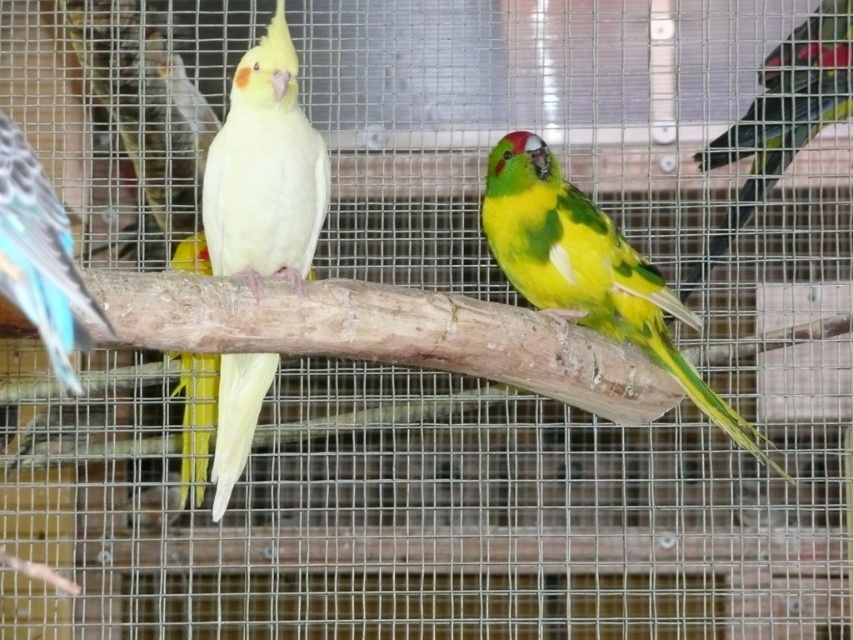
Question: Does green glossy parrot at right come behind yellow matte parrot at center?

Choices:
 (A) no
 (B) yes

Answer: (B)

Question: Which object is farther from the camera taking this photo?

Choices:
 (A) green glossy parrot at right
 (B) green matte parrot at center
 (C) yellow matte parrot at center

Answer: (A)

Question: Which object is farther from the camera taking this photo?

Choices:
 (A) yellow matte parrot at center
 (B) matte yellow parrot at center
 (C) green glossy parrot at right

Answer: (C)

Question: Among these objects, which one is farthest from the camera?

Choices:
 (A) yellow matte parrot at center
 (B) blue glossy wing at left
 (C) matte yellow parrot at center

Answer: (A)

Question: Does matte yellow parrot at center appear on the left side of blue glossy wing at left?

Choices:
 (A) yes
 (B) no

Answer: (B)

Question: Does green matte parrot at center appear on the right side of blue glossy wing at left?

Choices:
 (A) yes
 (B) no

Answer: (A)